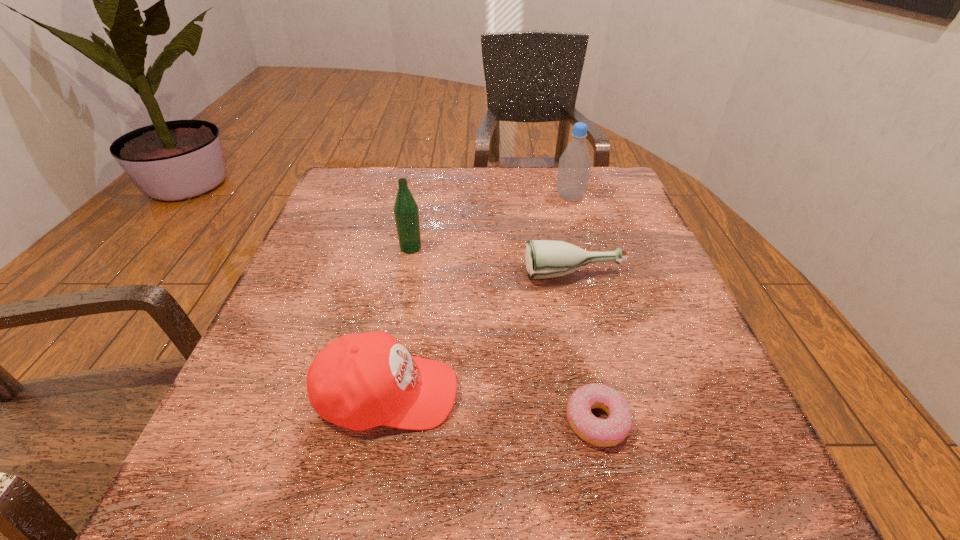
Find the location of a particular element. Image resolution: width=960 pixels, height=540 pixels. free space located on the front of the nearest bottle is located at coordinates (587, 326).

Where is `vacant area situated 0.060m on the left of the doughnut`? This screenshot has width=960, height=540. vacant area situated 0.060m on the left of the doughnut is located at coordinates (523, 421).

Identify the location of object at the far edge. The width and height of the screenshot is (960, 540). (574, 167).

You are a GUI agent. You are given a task and a screenshot of the screen. Output one action in this format:
    pyautogui.click(x=<x>, y=<y>)
    Task: Click on the object located at the left edge
    The width and height of the screenshot is (960, 540).
    Given the screenshot: What is the action you would take?
    pyautogui.click(x=360, y=381)

At what (x,y) coordinates should I click in order to perform the action: click on doughnut at the right edge. Please return your answer as a coordinate pair (x, y). This screenshot has height=540, width=960. Looking at the image, I should click on (607, 432).

Find the location of a particular element. The width and height of the screenshot is (960, 540). object present at the far right corner is located at coordinates (574, 167).

Where is `free region at the far edge of the desktop`? This screenshot has height=540, width=960. free region at the far edge of the desktop is located at coordinates (492, 187).

The height and width of the screenshot is (540, 960). Identify the location of free region at the left edge. (360, 239).

In the image, there is a desktop. Where is `vacant space at the right edge`? This screenshot has width=960, height=540. vacant space at the right edge is located at coordinates point(594,292).

Locate an element on the screen. This screenshot has width=960, height=540. free space at the near left corner of the desktop is located at coordinates (241, 525).